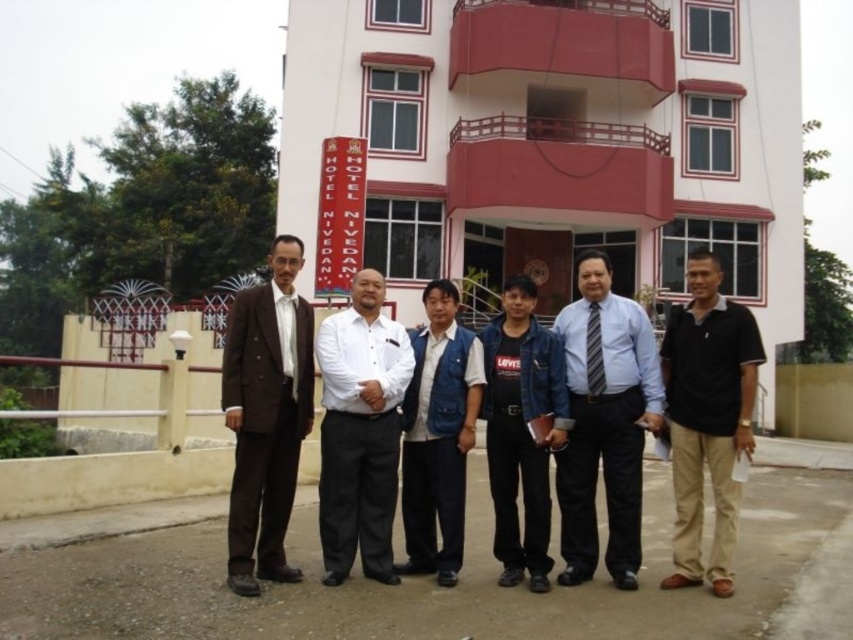
You are a photographer taking a group photo of the six individuals in front of Hotel Nivedan. You notice the black cotton polo shirt at right and the white shirt at center. Which shirt is positioned higher in the frame?

The black cotton polo shirt at right is located above the white shirt at center, so it is positioned higher in the frame.

You are a photographer planning to take a group photo of the individuals in front of Hotel Nivedan. You need to ensure that the white shirt at center and the striped fabric tie at center are both visible in the frame. Given their positions, which of the two items is more likely to be fully visible in the photo?

The white shirt at center is taller than the striped fabric tie at center, so the white shirt at center is more likely to be fully visible in the photo.